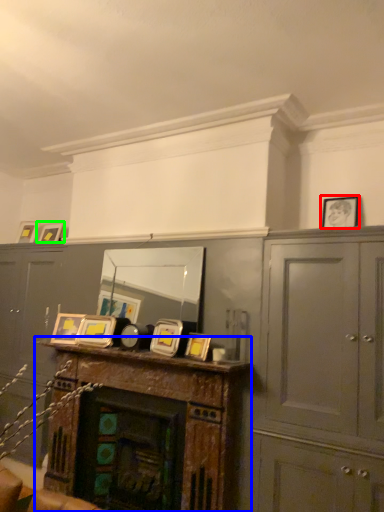
Question: Which object is the farthest from picture frame (highlighted by a red box)? Choose among these: table (highlighted by a blue box) or picture frame (highlighted by a green box).

Choices:
 (A) table
 (B) picture frame

Answer: (B)